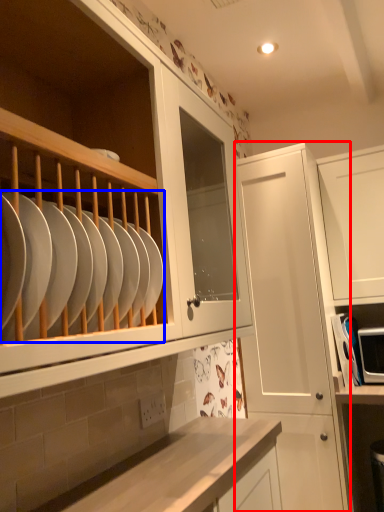
Question: Among these objects, which one is nearest to the camera, cabinetry (highlighted by a red box) or tableware (highlighted by a blue box)?

Choices:
 (A) cabinetry
 (B) tableware

Answer: (B)